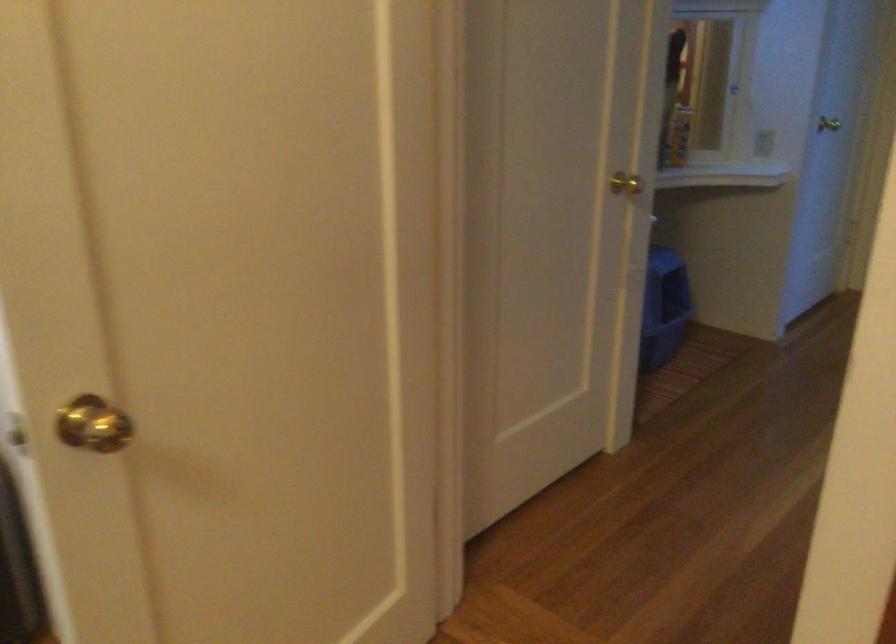
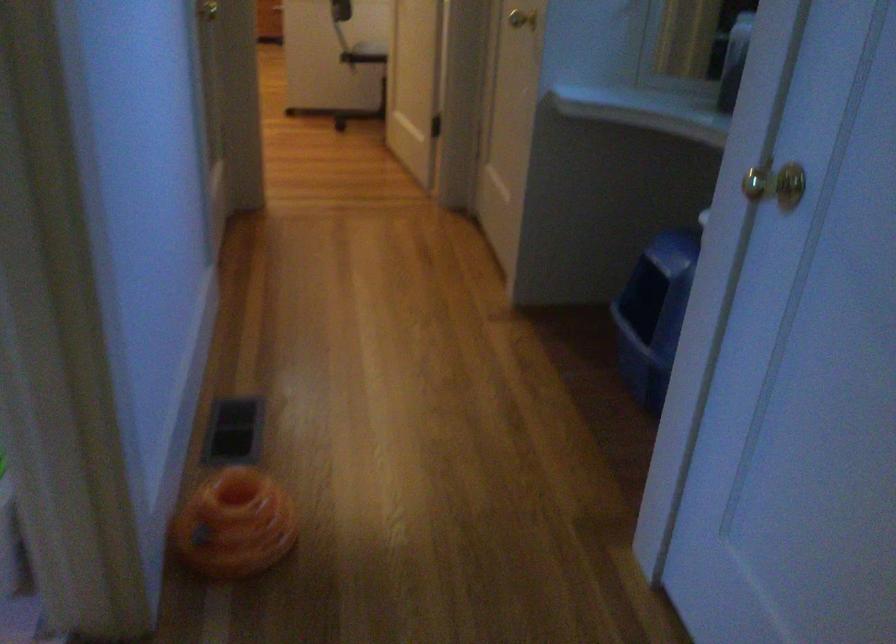
The point at [819,122] is marked in the first image. Where is the corresponding point in the second image?

(776, 184)